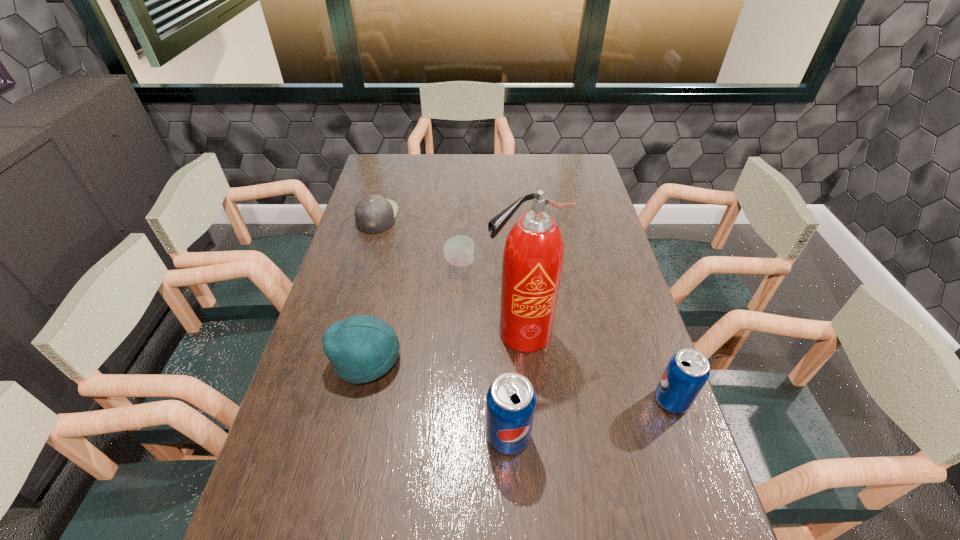
Locate which object is the fifth closest to the cap. Please provide its 2D coordinates. Your answer should be formatted as a tuple, i.e. [(x, y)], where the tuple contains the x and y coordinates of a point satisfying the conditions above.

[(688, 370)]

Select which object appears as the fourth closest to the right pop soda. Please provide its 2D coordinates. Your answer should be formatted as a tuple, i.e. [(x, y)], where the tuple contains the x and y coordinates of a point satisfying the conditions above.

[(361, 348)]

This screenshot has width=960, height=540. Find the location of `free space that satisfies the following two spatial constraints: 1. on the front side of the fire extinguisher; 2. on the right side of the rightmost object`. free space that satisfies the following two spatial constraints: 1. on the front side of the fire extinguisher; 2. on the right side of the rightmost object is located at coordinates pos(526,401).

Where is `free space in the image that satisfies the following two spatial constraints: 1. on the back side of the right pop soda; 2. on the brim of the farthest object`? free space in the image that satisfies the following two spatial constraints: 1. on the back side of the right pop soda; 2. on the brim of the farthest object is located at coordinates (608, 217).

At what (x,y) coordinates should I click in order to perform the action: click on free space that satisfies the following two spatial constraints: 1. on the brim of the cap; 2. on the right side of the third object from left to right. Please return your answer as a coordinate pair (x, y). The height and width of the screenshot is (540, 960). Looking at the image, I should click on (364, 262).

Locate an element on the screen. This screenshot has height=540, width=960. vacant space that satisfies the following two spatial constraints: 1. on the brim of the third shortest object; 2. on the left side of the cap is located at coordinates (337, 360).

Locate an element on the screen. free space in the image that satisfies the following two spatial constraints: 1. on the back side of the left pop soda; 2. on the left side of the fire extinguisher is located at coordinates (503, 333).

You are a GUI agent. You are given a task and a screenshot of the screen. Output one action in this format:
    pyautogui.click(x=<x>, y=<y>)
    Task: Click on the vacant region that satisfies the following two spatial constraints: 1. on the brim of the fire extinguisher; 2. on the left side of the farthest object
    Image resolution: width=960 pixels, height=540 pixels.
    Given the screenshot: What is the action you would take?
    pyautogui.click(x=345, y=333)

The width and height of the screenshot is (960, 540). Identify the location of free space that satisfies the following two spatial constraints: 1. on the back side of the shorter pop soda; 2. on the brim of the cap. (608, 217).

The image size is (960, 540). I want to click on free space that satisfies the following two spatial constraints: 1. on the brim of the farthest object; 2. on the left side of the shorter pop soda, so click(x=325, y=401).